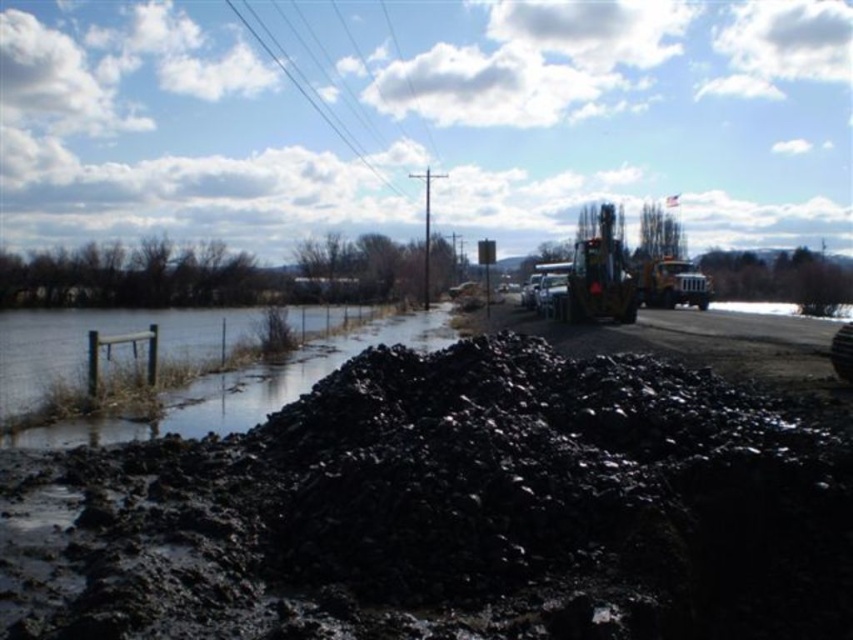
From the picture: You are standing at the center of the flooded road and want to cross to the other side. There is a clear water area at the fence on the left. Can you reach the clear water at fence left from your current position without getting into the flooded area?

The clear water at fence left is located at point (247, 387), so yes, you can reach it by moving towards the coordinates provided, avoiding the flooded areas.

You are a delivery driver who needs to cross the flooded road. You see the black mud at center and the metallic silver trailer truck at right. Which object is taller, and how might this affect your decision to proceed?

The metallic silver trailer truck at right is taller than the black mud at center. Since the truck is taller, it might have a better chance of safely passing over the flooded area without getting stuck, whereas the black mud at center could pose a risk of sinking or causing delays. However, you should still exercise caution due to the flooded conditions.